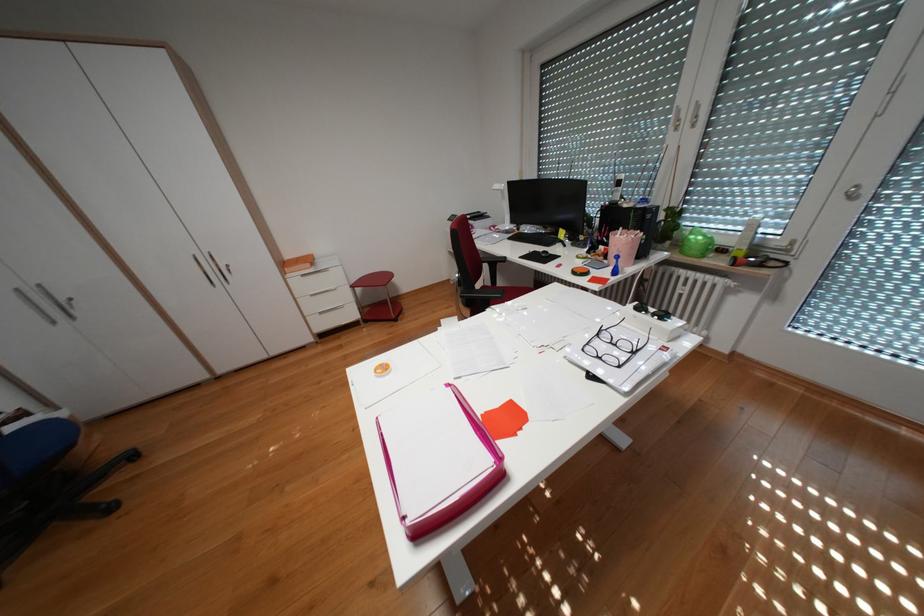
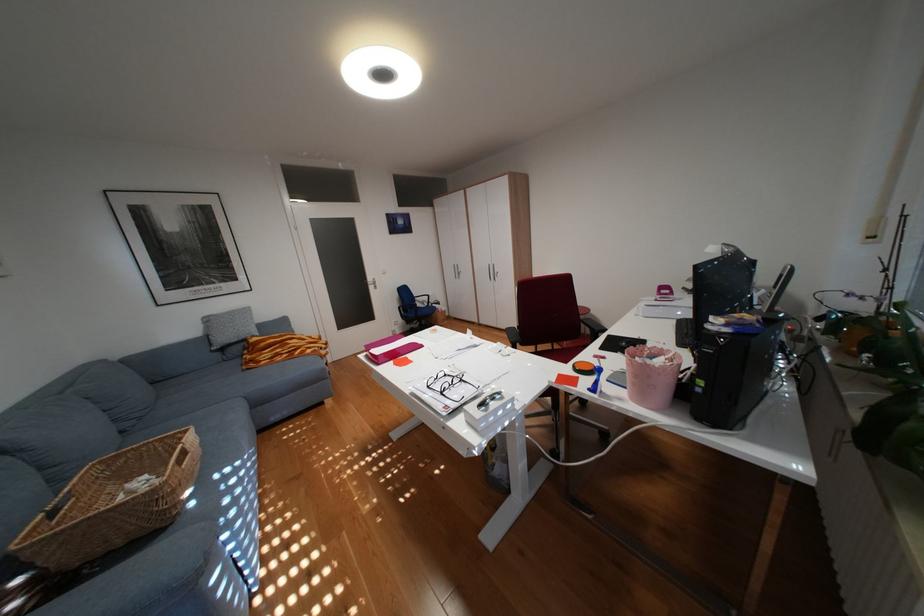
The point at [417,517] is marked in the first image. Where is the corresponding point in the second image?

(383, 350)